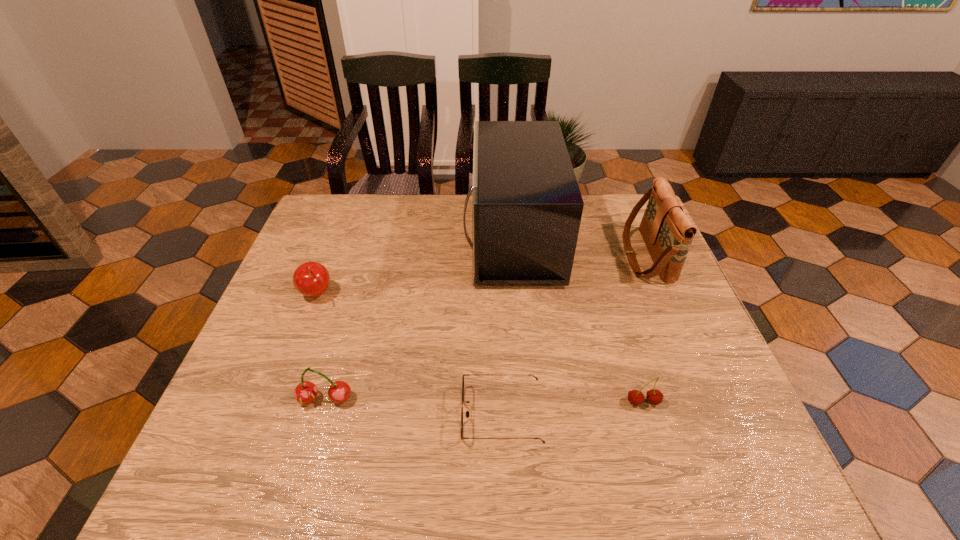
This screenshot has width=960, height=540. In order to click on vacant space located 0.310m on the front-facing side of the sunglasses in this screenshot , I will do `click(311, 414)`.

The width and height of the screenshot is (960, 540). Identify the location of microwave oven that is at the far edge. tap(527, 207).

I want to click on shoulder bag present at the far edge, so click(x=667, y=232).

This screenshot has width=960, height=540. I want to click on object at the near edge, so click(x=467, y=412).

Find the location of `shoulder bag at the right edge`. shoulder bag at the right edge is located at coordinates (667, 232).

Locate an element on the screen. The image size is (960, 540). cherry situated at the right edge is located at coordinates (635, 397).

In order to click on object that is at the far right corner in this screenshot , I will do `click(667, 232)`.

In order to click on vacant region at the far edge in this screenshot , I will do `click(454, 206)`.

At what (x,y) coordinates should I click in order to perform the action: click on vacant space at the near edge of the desktop. Please return your answer as a coordinate pair (x, y). Looking at the image, I should click on (405, 443).

Where is `blank area at the left edge`? blank area at the left edge is located at coordinates (295, 373).